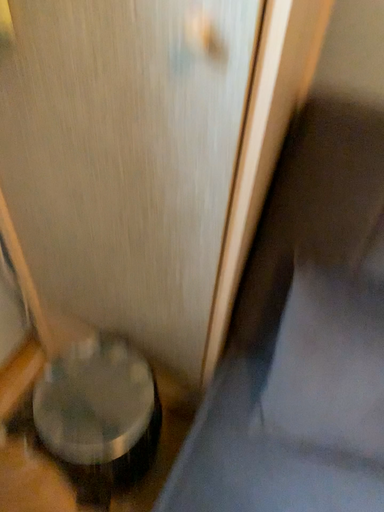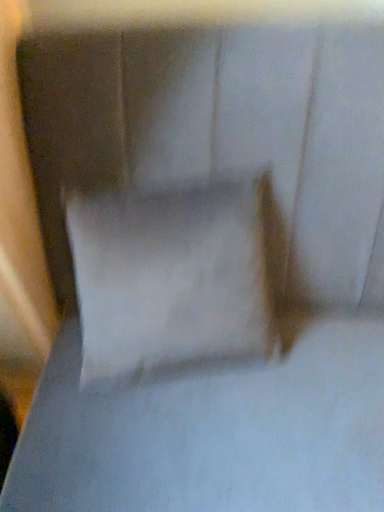
Question: How did the camera likely rotate when shooting the video?

Choices:
 (A) rotated right
 (B) rotated left

Answer: (A)